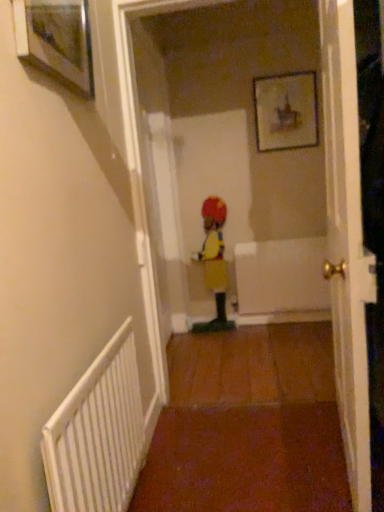
Question: Relative to white textured radiator at lower left, is yellow fabric clown at center in front or behind?

Choices:
 (A) front
 (B) behind

Answer: (B)

Question: From a real-world perspective, is yellow fabric clown at center above or below white textured radiator at lower left?

Choices:
 (A) above
 (B) below

Answer: (A)

Question: Estimate the real-world distances between objects in this image. Which object is farther from the wooden framed picture at upper left, acting as the first picture frame starting from the front?

Choices:
 (A) white textured radiator at lower left
 (B) wooden picture frame at upper center, the first picture frame when ordered from back to front
 (C) yellow fabric clown at center
 (D) white glossy door at center

Answer: (C)

Question: Which object is positioned closest to the white textured radiator at lower left?

Choices:
 (A) yellow fabric clown at center
 (B) wooden framed picture at upper left, which ranks as the 2th picture frame in right-to-left order
 (C) white glossy door at center
 (D) wooden picture frame at upper center, placed as the 1th picture frame when sorted from right to left

Answer: (C)